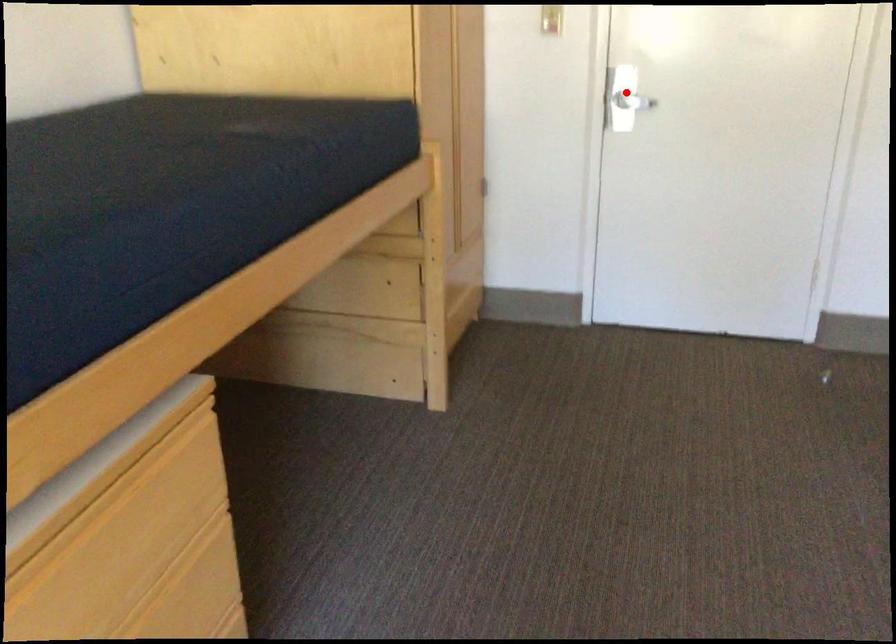
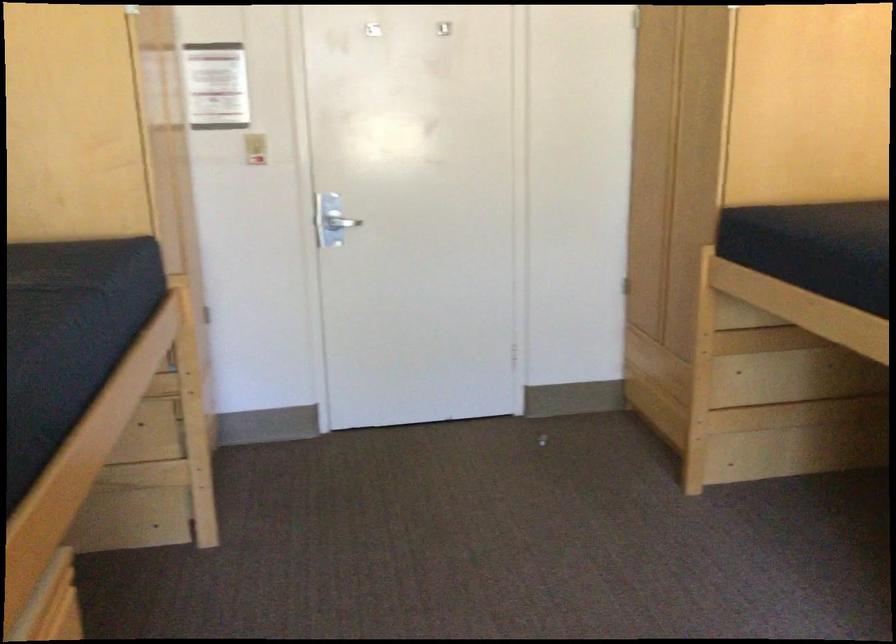
In the second image, find the point that corresponds to the highlighted location in the first image.

(332, 222)